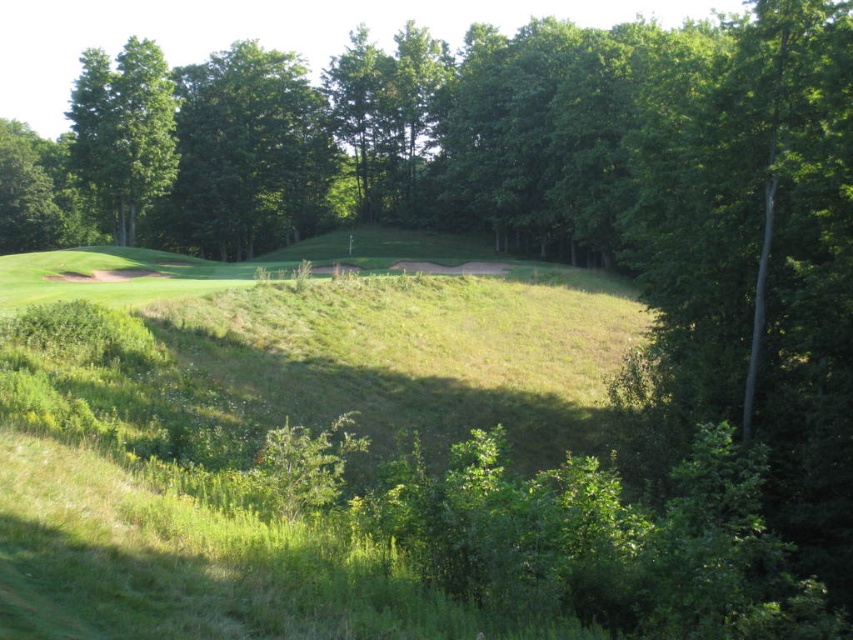
You are a golfer standing on the fairway and want to hit your ball over the green leafy tree at upper center and the green leafy tree at upper left. Which tree requires less power to clear?

The green leafy tree at upper center is thinner than the green leafy tree at upper left, so it requires less power to clear.

You are standing on the golf course and see the green leafy tree at upper center and the green leafy tree at upper left. Which tree is closer to you?

The green leafy tree at upper center is closer to you because it is positioned further to the viewer than the green leafy tree at upper left.